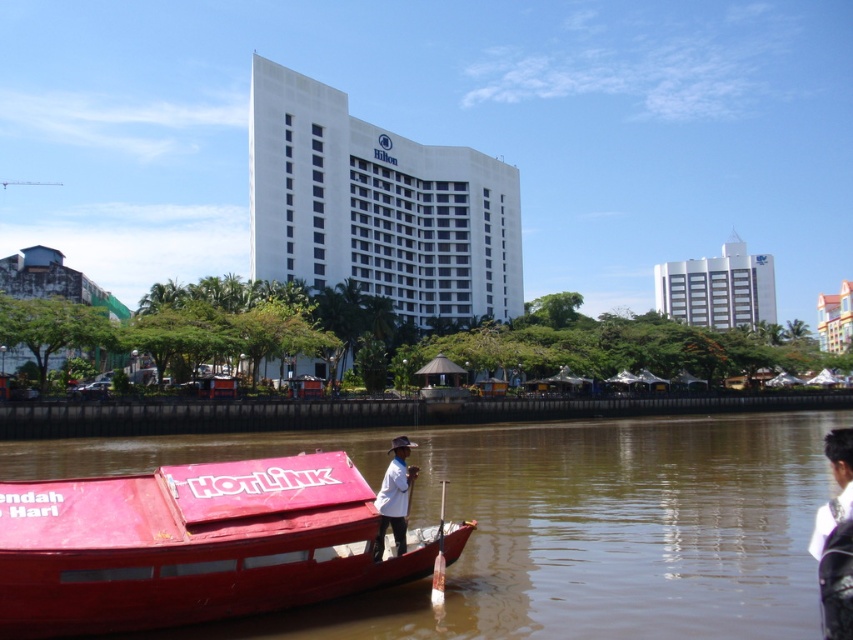
You are a photographer trying to capture the white matte shirt at center and the wooden paddle at lower center in the same frame. Since you want to ensure both are clearly visible, which object should you focus on first considering their sizes?

The white matte shirt at center should be focused on first because its width is larger than the wooden paddle at lower center, making it more prominent in the frame.

You are a photographer trying to capture both the white matte shirt at center and the wooden paddle at lower center in a single shot. Given their sizes, which object would you need to position closer to the camera to ensure both are visible clearly?

The wooden paddle at lower center is smaller than the white matte shirt at center. To ensure both are visible clearly in the photo, you should position the wooden paddle at lower center closer to the camera since it is smaller and needs to be magnified to match the visibility of the larger white matte shirt at center.

From the picture: You are a photographer trying to capture both the white fabric shirt at lower right and the white matte shirt at center in a single frame. Since the shirts are different sizes, which one should you focus on to ensure both are visible without cropping?

The white fabric shirt at lower right is bigger than the white matte shirt at center. To ensure both are visible without cropping, focus on the smaller white matte shirt at center first, then adjust the frame to include the larger white fabric shirt at lower right.